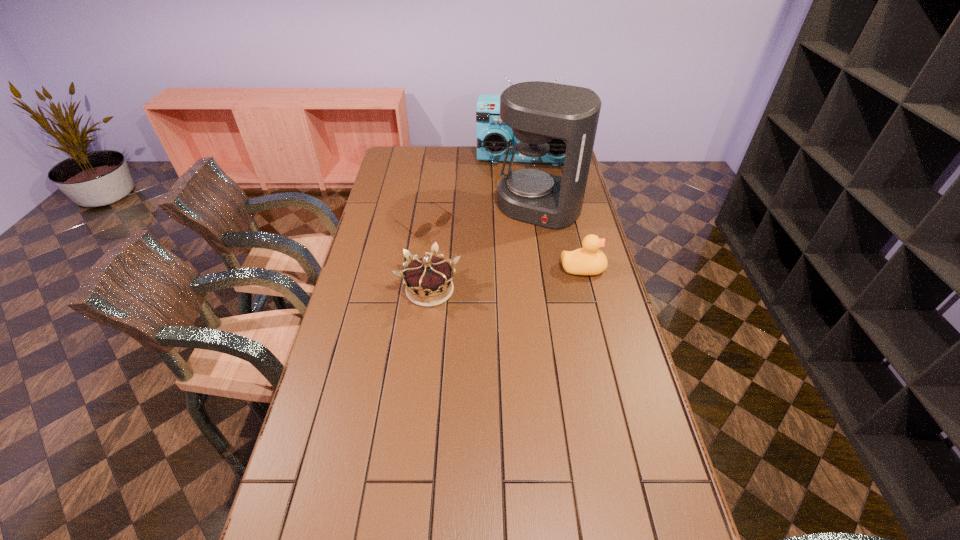
Where is `crown`? Image resolution: width=960 pixels, height=540 pixels. crown is located at coordinates (428, 276).

Find the location of a particular element. duck is located at coordinates (589, 260).

Identify the location of the second tallest object. This screenshot has width=960, height=540. (494, 137).

The width and height of the screenshot is (960, 540). Identify the location of the farthest object. (494, 137).

Find the location of a particular element. Image resolution: width=960 pixels, height=540 pixels. coffee maker is located at coordinates (537, 112).

The width and height of the screenshot is (960, 540). Find the location of `sunglasses`. sunglasses is located at coordinates (444, 218).

Find the location of a particular element. free space located on the front of the crown is located at coordinates (419, 389).

The width and height of the screenshot is (960, 540). I want to click on vacant area situated 0.250m on the front-facing side of the second tallest object, so click(x=520, y=200).

The height and width of the screenshot is (540, 960). In order to click on vacant space located 0.370m on the front-facing side of the second tallest object in this screenshot , I will do `click(520, 217)`.

The width and height of the screenshot is (960, 540). Find the location of `vacant space situated on the front-facing side of the second tallest object`. vacant space situated on the front-facing side of the second tallest object is located at coordinates (521, 190).